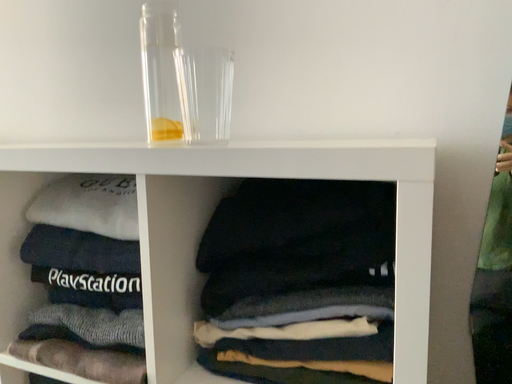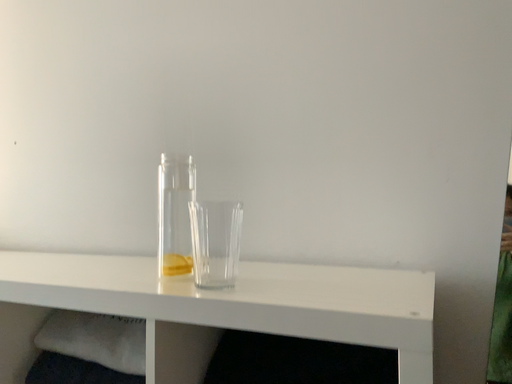
Question: How did the camera likely rotate when shooting the video?

Choices:
 (A) rotated downward
 (B) rotated upward

Answer: (B)